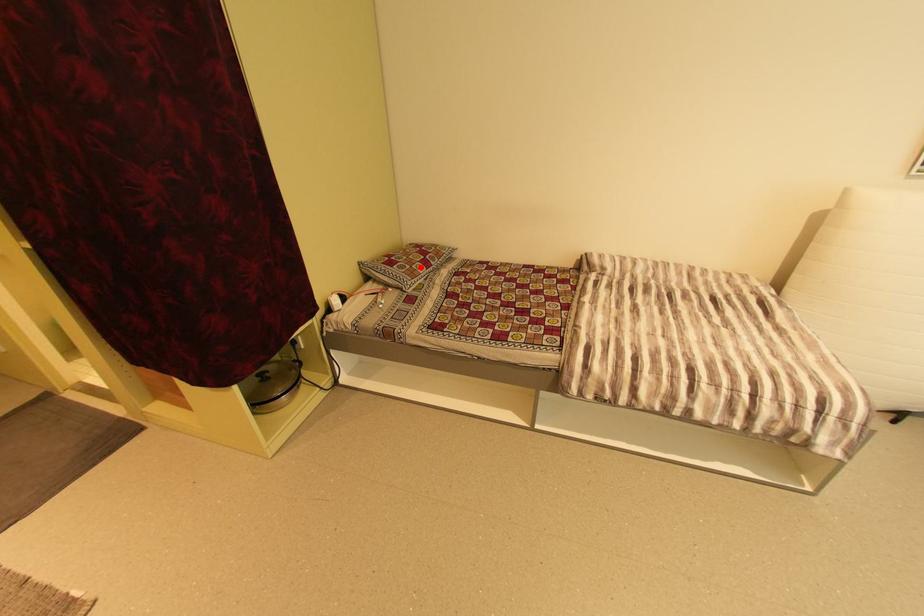
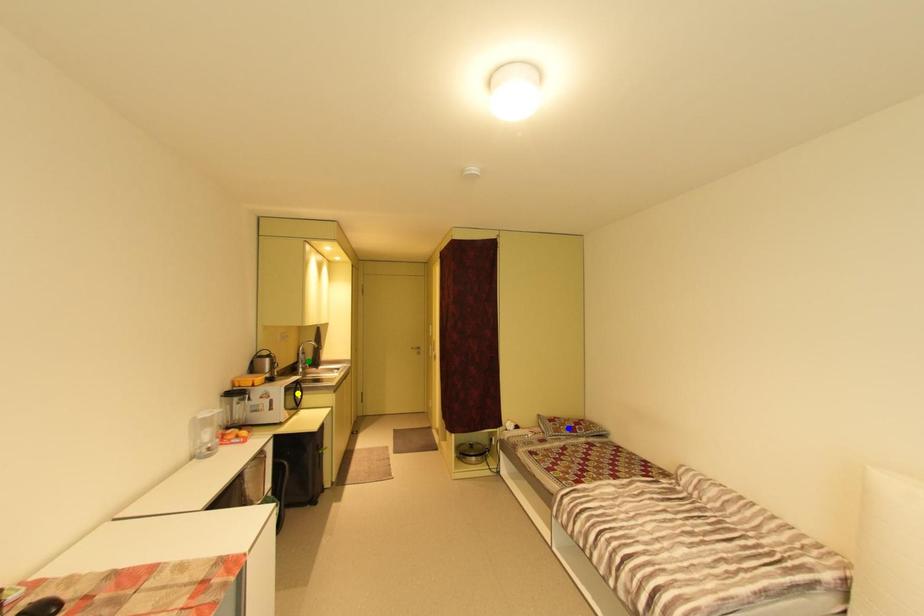
Question: I am providing you with two images of the same scene from different viewpoints. A red point is marked on the first image. You are given multiple points on the second image. In image 2, which mark is for the same physical point as the one in image 1?

Choices:
 (A) yellow point
 (B) blue point
 (C) green point

Answer: (B)